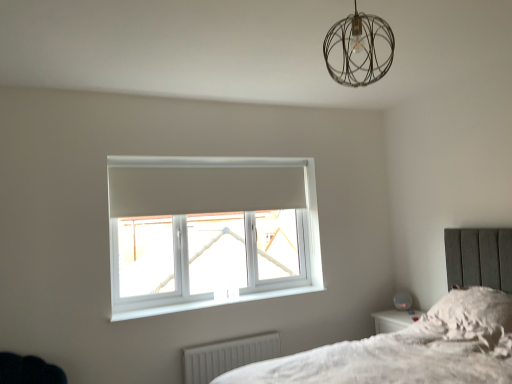
Question: From the image's perspective, does metallic wire sphere at upper center appear higher than white plastic window sill at lower center?

Choices:
 (A) no
 (B) yes

Answer: (B)

Question: From the image's perspective, is metallic wire sphere at upper center under white plastic window sill at lower center?

Choices:
 (A) no
 (B) yes

Answer: (A)

Question: Does metallic wire sphere at upper center have a larger size compared to white plastic window sill at lower center?

Choices:
 (A) no
 (B) yes

Answer: (B)

Question: Is metallic wire sphere at upper center to the right of white plastic window sill at lower center from the viewer's perspective?

Choices:
 (A) no
 (B) yes

Answer: (B)

Question: Are metallic wire sphere at upper center and white plastic window sill at lower center far apart?

Choices:
 (A) yes
 (B) no

Answer: (A)

Question: Is metallic wire sphere at upper center thinner than white plastic window sill at lower center?

Choices:
 (A) no
 (B) yes

Answer: (A)

Question: From a real-world perspective, is fluffy white pillow at lower right physically below white plastic window sill at lower center?

Choices:
 (A) no
 (B) yes

Answer: (B)

Question: Does fluffy white pillow at lower right appear on the right side of white plastic window sill at lower center?

Choices:
 (A) no
 (B) yes

Answer: (B)

Question: Is fluffy white pillow at lower right outside of white plastic window sill at lower center?

Choices:
 (A) no
 (B) yes

Answer: (B)

Question: From a real-world perspective, is fluffy white pillow at lower right over white plastic window sill at lower center?

Choices:
 (A) yes
 (B) no

Answer: (B)

Question: Can you confirm if fluffy white pillow at lower right is smaller than white plastic window sill at lower center?

Choices:
 (A) no
 (B) yes

Answer: (A)

Question: Considering the relative sizes of fluffy white pillow at lower right and white plastic window sill at lower center in the image provided, is fluffy white pillow at lower right shorter than white plastic window sill at lower center?

Choices:
 (A) no
 (B) yes

Answer: (A)

Question: Does white ribbed radiator at lower center turn towards white plastic window at center?

Choices:
 (A) yes
 (B) no

Answer: (B)